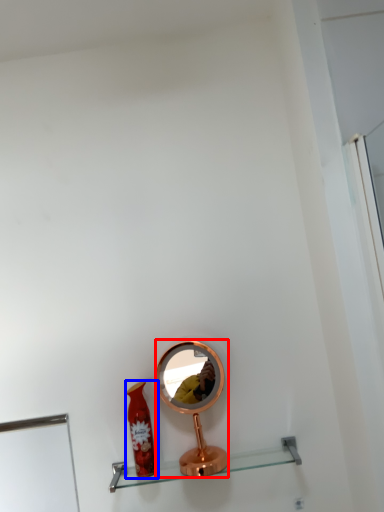
Question: Which of the following is the farthest to the observer, mirror (highlighted by a red box) or bottle (highlighted by a blue box)?

Choices:
 (A) mirror
 (B) bottle

Answer: (A)